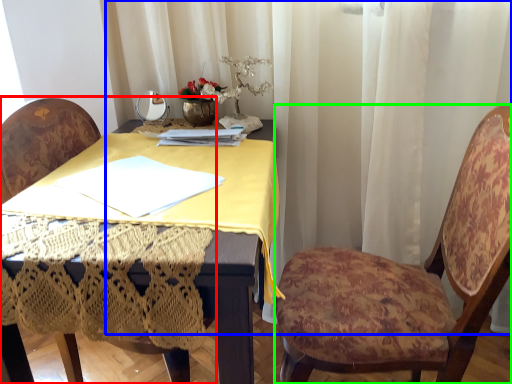
Question: Which object is the farthest from chair (highlighted by a red box)? Choose among these: curtain (highlighted by a blue box) or chair (highlighted by a green box).

Choices:
 (A) curtain
 (B) chair

Answer: (B)